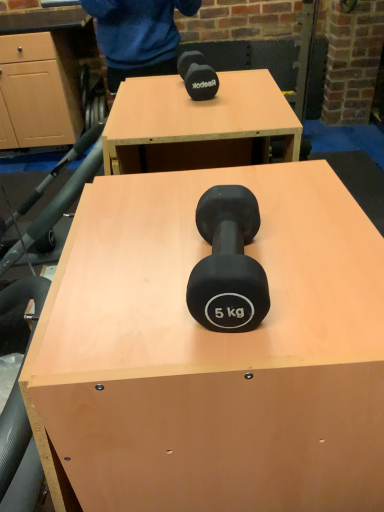
Image resolution: width=384 pixels, height=512 pixels. What are the coordinates of `vacant area that lies in front of black rubber dumbbell at center` in the screenshot? It's located at (242, 352).